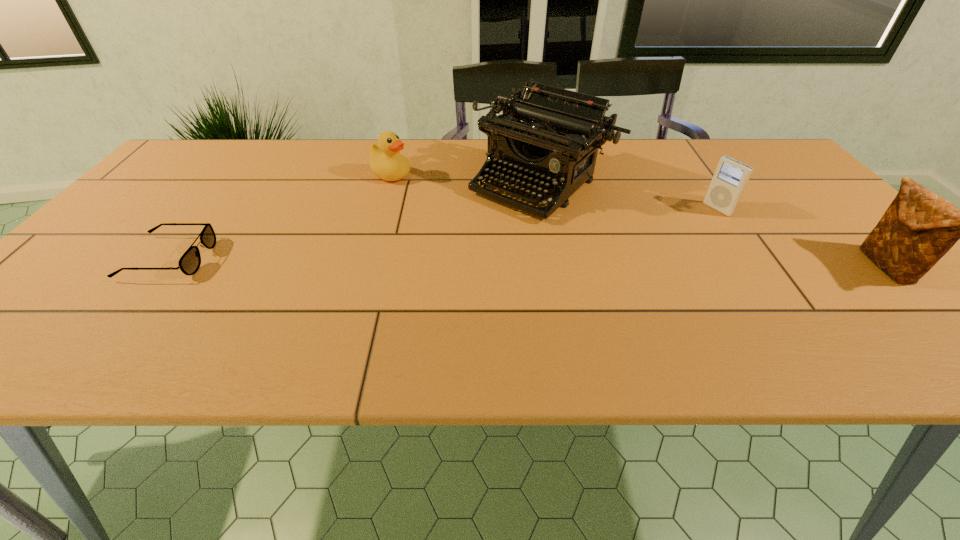
Identify the location of free spot on the desktop that is between the shortest object and the fourth shortest object and is positioned on the front-facing side of the second object from right to left. (617, 264).

The image size is (960, 540). I want to click on vacant space on the desktop that is between the leftmost object and the rightmost object and is positioned at the beak of the fourth object from right to left, so click(x=585, y=264).

Locate an element on the screen. This screenshot has height=540, width=960. vacant space on the desktop that is between the spectacles and the clutch bag and is positioned on the keyboard of the third object from right to left is located at coordinates (449, 261).